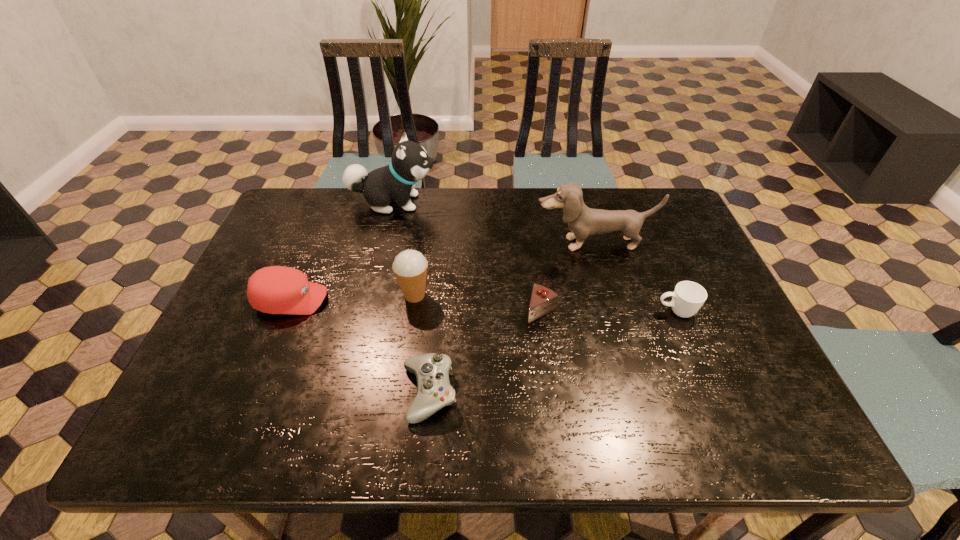
Locate an element on the screen. The height and width of the screenshot is (540, 960). puppy that is at the right edge is located at coordinates (583, 221).

This screenshot has height=540, width=960. I want to click on cup that is at the right edge, so click(x=688, y=297).

Where is `object positioned at the far right corner`? object positioned at the far right corner is located at coordinates (583, 221).

Identify the location of free space at the far edge. The width and height of the screenshot is (960, 540). (493, 233).

Where is `free space at the near edge of the desktop`? This screenshot has width=960, height=540. free space at the near edge of the desktop is located at coordinates (589, 408).

I want to click on vacant region at the left edge, so click(x=232, y=338).

In the image, there is a desktop. Where is `vacant space at the far left corner`? vacant space at the far left corner is located at coordinates (305, 199).

In order to click on vacant region at the near left corner of the desktop in this screenshot , I will do `click(228, 427)`.

Where is `free area in between the cup and the fourth shortest object`? The height and width of the screenshot is (540, 960). free area in between the cup and the fourth shortest object is located at coordinates (484, 306).

You are a GUI agent. You are given a task and a screenshot of the screen. Output one action in this format:
    pyautogui.click(x=<x>, y=<y>)
    Task: Click on the free spot between the farther puppy and the right puppy
    The width and height of the screenshot is (960, 540).
    Given the screenshot: What is the action you would take?
    pyautogui.click(x=493, y=223)